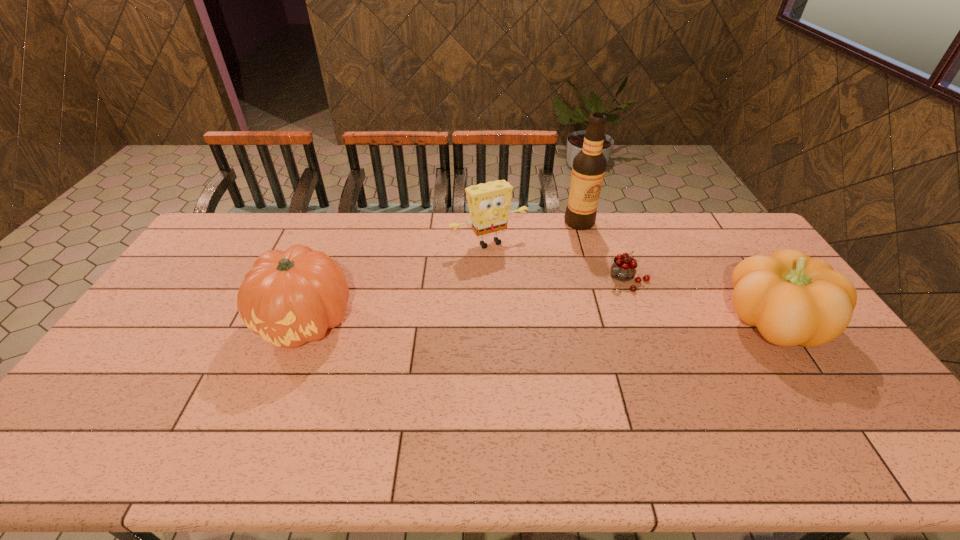
The image size is (960, 540). In order to click on vacant space on the desktop that is between the leftmost object and the rightmost object and is positioned on the face of the sponge in this screenshot , I will do `click(545, 322)`.

At what (x,y) coordinates should I click in order to perform the action: click on vacant spot on the desktop that is between the left pumpkin and the rightmost object and is positioned on the handle side of the pot filled with cherries. Please return your answer as a coordinate pair (x, y). Looking at the image, I should click on (581, 322).

Where is `vacant space on the desktop that is between the left pumpkin and the right pumpkin and is positioned on the label of the alcohol`? The image size is (960, 540). vacant space on the desktop that is between the left pumpkin and the right pumpkin and is positioned on the label of the alcohol is located at coordinates (601, 322).